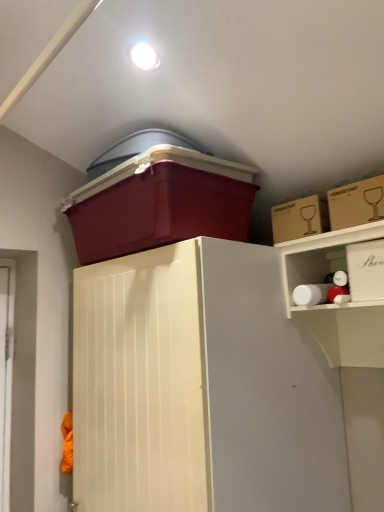
Describe the element at coordinates (366, 270) in the screenshot. I see `white cardboard box at upper right, which ranks as the 4th storage box in left-to-right order` at that location.

Identify the location of cardboard box at upper right, placed as the second storage box when sorted from right to left. (356, 203).

Find the location of a particular element. This screenshot has height=512, width=384. cardboard box at upper right, marked as the second storage box in a left-to-right arrangement is located at coordinates (300, 218).

This screenshot has height=512, width=384. Identify the location of matte plastic storage box at upper center, the fourth storage box when ordered from right to left. (160, 203).

Can you confirm if cardboard box at upper right, which ranks as the third storage box in right-to-left order, is smaller than white cardboard box at upper right, which ranks as the 4th storage box in left-to-right order?

Indeed, cardboard box at upper right, which ranks as the third storage box in right-to-left order, has a smaller size compared to white cardboard box at upper right, which ranks as the 4th storage box in left-to-right order.

Is cardboard box at upper right, which ranks as the third storage box in right-to-left order, oriented towards white cardboard box at upper right, which ranks as the 4th storage box in left-to-right order?

Answer: No, cardboard box at upper right, which ranks as the third storage box in right-to-left order, is not turned towards white cardboard box at upper right, which ranks as the 4th storage box in left-to-right order.

Is cardboard box at upper right, which ranks as the third storage box in right-to-left order, taller than white cardboard box at upper right, the 1th storage box from the right?

No.

In the image, is cardboard box at upper right, which ranks as the third storage box in right-to-left order, on the left side or the right side of white cardboard box at upper right, the 1th storage box from the right?

In the image, cardboard box at upper right, which ranks as the third storage box in right-to-left order, appears on the left side of white cardboard box at upper right, the 1th storage box from the right.

Would you say cardboard box at upper right, which is counted as the 3th storage box, starting from the left, is outside white cardboard box at upper right, the 1th storage box from the right?

Result: Indeed, cardboard box at upper right, which is counted as the 3th storage box, starting from the left, is completely outside white cardboard box at upper right, the 1th storage box from the right.

Consider the image. Is white cardboard box at upper right, which ranks as the 4th storage box in left-to-right order, at the back of cardboard box at upper right, placed as the second storage box when sorted from right to left?

No, cardboard box at upper right, placed as the second storage box when sorted from right to left, is not facing the opposite direction of white cardboard box at upper right, which ranks as the 4th storage box in left-to-right order.

From the image's perspective, which object appears higher, cardboard box at upper right, placed as the second storage box when sorted from right to left, or white cardboard box at upper right, the 1th storage box from the right?

cardboard box at upper right, placed as the second storage box when sorted from right to left.

Can you tell me how much cardboard box at upper right, which is counted as the 3th storage box, starting from the left, and white cardboard box at upper right, the 1th storage box from the right, differ in facing direction?

There is a 0.966-degree angle between the facing directions of cardboard box at upper right, which is counted as the 3th storage box, starting from the left, and white cardboard box at upper right, the 1th storage box from the right.

Is cardboard box at upper right, marked as the second storage box in a left-to-right arrangement, oriented towards matte plastic storage box at upper center, the fourth storage box when ordered from right to left?

No, cardboard box at upper right, marked as the second storage box in a left-to-right arrangement, is not aimed at matte plastic storage box at upper center, the fourth storage box when ordered from right to left.

How different are the orientations of cardboard box at upper right, which ranks as the third storage box in right-to-left order, and matte plastic storage box at upper center, arranged as the first storage box when viewed from the left, in degrees?

The facing directions of cardboard box at upper right, which ranks as the third storage box in right-to-left order, and matte plastic storage box at upper center, arranged as the first storage box when viewed from the left, are 2.96 degrees apart.

Is cardboard box at upper right, marked as the second storage box in a left-to-right arrangement, to the left of matte plastic storage box at upper center, arranged as the first storage box when viewed from the left, from the viewer's perspective?

In fact, cardboard box at upper right, marked as the second storage box in a left-to-right arrangement, is to the right of matte plastic storage box at upper center, arranged as the first storage box when viewed from the left.

From their relative heights in the image, would you say cardboard box at upper right, marked as the second storage box in a left-to-right arrangement, is taller or shorter than matte plastic storage box at upper center, the fourth storage box when ordered from right to left?

Considering their sizes, cardboard box at upper right, marked as the second storage box in a left-to-right arrangement, has less height than matte plastic storage box at upper center, the fourth storage box when ordered from right to left.

From a real-world perspective, who is located higher, cardboard box at upper right, marked as the second storage box in a left-to-right arrangement, or cardboard box at upper right, placed as the second storage box when sorted from right to left?

cardboard box at upper right, marked as the second storage box in a left-to-right arrangement, is physically above.

Does cardboard box at upper right, marked as the second storage box in a left-to-right arrangement, have a smaller size compared to cardboard box at upper right, placed as the second storage box when sorted from right to left?

No, cardboard box at upper right, marked as the second storage box in a left-to-right arrangement, is not smaller than cardboard box at upper right, placed as the second storage box when sorted from right to left.

From the picture: From the image's perspective, does cardboard box at upper right, which ranks as the third storage box in right-to-left order, appear higher than cardboard box at upper right, which is counted as the 3th storage box, starting from the left?

No, from the image's perspective, cardboard box at upper right, which ranks as the third storage box in right-to-left order, is not on top of cardboard box at upper right, which is counted as the 3th storage box, starting from the left.

Can we say white cardboard box at upper right, the 1th storage box from the right, lies outside cardboard box at upper right, marked as the second storage box in a left-to-right arrangement?

Yes, white cardboard box at upper right, the 1th storage box from the right, is outside of cardboard box at upper right, marked as the second storage box in a left-to-right arrangement.

Looking at this image, can you confirm if white cardboard box at upper right, the 1th storage box from the right, is taller than cardboard box at upper right, which ranks as the third storage box in right-to-left order?

Yes.

How far apart are white cardboard box at upper right, the 1th storage box from the right, and cardboard box at upper right, which ranks as the third storage box in right-to-left order?

6.62 inches.

Based on the photo, from the image's perspective, is white cardboard box at upper right, the 1th storage box from the right, on top of cardboard box at upper right, marked as the second storage box in a left-to-right arrangement?

No, from the image's perspective, white cardboard box at upper right, the 1th storage box from the right, is not over cardboard box at upper right, marked as the second storage box in a left-to-right arrangement.

Would you say matte plastic storage box at upper center, arranged as the first storage box when viewed from the left, is a long distance from white cardboard box at upper right, which ranks as the 4th storage box in left-to-right order?

No, matte plastic storage box at upper center, arranged as the first storage box when viewed from the left, is in close proximity to white cardboard box at upper right, which ranks as the 4th storage box in left-to-right order.

Consider the image. Does matte plastic storage box at upper center, the fourth storage box when ordered from right to left, turn towards white cardboard box at upper right, which ranks as the 4th storage box in left-to-right order?

No, matte plastic storage box at upper center, the fourth storage box when ordered from right to left, is not oriented towards white cardboard box at upper right, which ranks as the 4th storage box in left-to-right order.

Is the position of matte plastic storage box at upper center, arranged as the first storage box when viewed from the left, more distant than that of white cardboard box at upper right, the 1th storage box from the right?

Yes, matte plastic storage box at upper center, arranged as the first storage box when viewed from the left, is further from the viewer.

Which is in front, point (139, 183) or point (371, 250)?

The point (371, 250) is in front.

Consider the image. Measure the distance between cardboard box at upper right, which is counted as the 3th storage box, starting from the left, and cardboard box at upper right, which ranks as the third storage box in right-to-left order.

cardboard box at upper right, which is counted as the 3th storage box, starting from the left, and cardboard box at upper right, which ranks as the third storage box in right-to-left order, are 3.98 inches apart from each other.

Is cardboard box at upper right, placed as the second storage box when sorted from right to left, aimed at cardboard box at upper right, marked as the second storage box in a left-to-right arrangement?

No, cardboard box at upper right, placed as the second storage box when sorted from right to left, is not turned towards cardboard box at upper right, marked as the second storage box in a left-to-right arrangement.

Considering the positions of point (360, 209) and point (318, 226), is point (360, 209) closer or farther from the camera than point (318, 226)?

Point (360, 209) appears to be closer to the viewer than point (318, 226).

The image size is (384, 512). Identify the location of the 3rd storage box behind when counting from the white cardboard box at upper right, which ranks as the 4th storage box in left-to-right order. (300, 218).

Locate an element on the screen. storage box that is the 3rd one when counting downward from the cardboard box at upper right, which is counted as the 3th storage box, starting from the left (from the image's perspective) is located at coordinates (366, 270).

Based on their spatial positions, is matte plastic storage box at upper center, arranged as the first storage box when viewed from the left, or cardboard box at upper right, which is counted as the 3th storage box, starting from the left, closer to cardboard box at upper right, which ranks as the third storage box in right-to-left order?

cardboard box at upper right, which is counted as the 3th storage box, starting from the left.

Looking at the image, which one is located closer to matte plastic storage box at upper center, the fourth storage box when ordered from right to left, cardboard box at upper right, placed as the second storage box when sorted from right to left, or cardboard box at upper right, marked as the second storage box in a left-to-right arrangement?

Among the two, cardboard box at upper right, marked as the second storage box in a left-to-right arrangement, is located nearer to matte plastic storage box at upper center, the fourth storage box when ordered from right to left.

Which object lies further to the anchor point cardboard box at upper right, which is counted as the 3th storage box, starting from the left, cardboard box at upper right, marked as the second storage box in a left-to-right arrangement, or white cardboard box at upper right, the 1th storage box from the right?

white cardboard box at upper right, the 1th storage box from the right, is further to cardboard box at upper right, which is counted as the 3th storage box, starting from the left.

Which object lies nearer to the anchor point cardboard box at upper right, which is counted as the 3th storage box, starting from the left, cardboard box at upper right, which ranks as the third storage box in right-to-left order, or matte plastic storage box at upper center, arranged as the first storage box when viewed from the left?

cardboard box at upper right, which ranks as the third storage box in right-to-left order, lies closer to cardboard box at upper right, which is counted as the 3th storage box, starting from the left, than the other object.

Estimate the real-world distances between objects in this image. Which object is closer to cardboard box at upper right, marked as the second storage box in a left-to-right arrangement, white cardboard box at upper right, the 1th storage box from the right, or cardboard box at upper right, which is counted as the 3th storage box, starting from the left?

cardboard box at upper right, which is counted as the 3th storage box, starting from the left, lies closer to cardboard box at upper right, marked as the second storage box in a left-to-right arrangement, than the other object.

Which object lies nearer to the anchor point white cardboard box at upper right, the 1th storage box from the right, cardboard box at upper right, placed as the second storage box when sorted from right to left, or matte plastic storage box at upper center, the fourth storage box when ordered from right to left?

Among the two, cardboard box at upper right, placed as the second storage box when sorted from right to left, is located nearer to white cardboard box at upper right, the 1th storage box from the right.

Based on their spatial positions, is cardboard box at upper right, which ranks as the third storage box in right-to-left order, or white cardboard box at upper right, which ranks as the 4th storage box in left-to-right order, closer to matte plastic storage box at upper center, arranged as the first storage box when viewed from the left?

cardboard box at upper right, which ranks as the third storage box in right-to-left order, lies closer to matte plastic storage box at upper center, arranged as the first storage box when viewed from the left, than the other object.

Based on their spatial positions, is cardboard box at upper right, placed as the second storage box when sorted from right to left, or matte plastic storage box at upper center, the fourth storage box when ordered from right to left, further from cardboard box at upper right, marked as the second storage box in a left-to-right arrangement?

matte plastic storage box at upper center, the fourth storage box when ordered from right to left.

Find the location of a particular element. The width and height of the screenshot is (384, 512). storage box between matte plastic storage box at upper center, the fourth storage box when ordered from right to left, and cardboard box at upper right, placed as the second storage box when sorted from right to left is located at coordinates (300, 218).